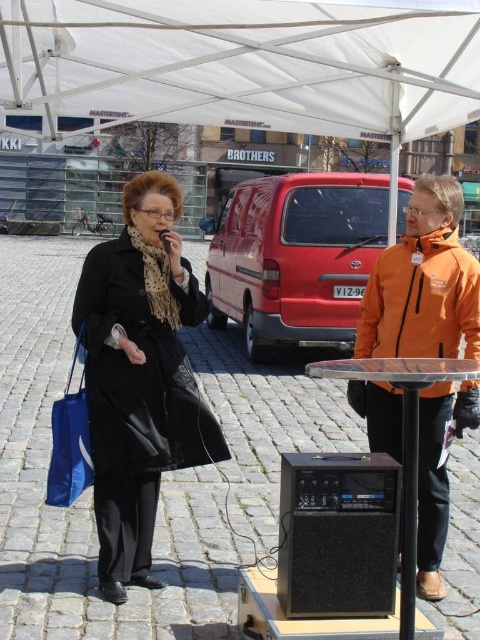
Question: Which object is farther from the camera taking this photo?

Choices:
 (A) black leather coat at center
 (B) white fabric canopy at upper center

Answer: (A)

Question: Among these objects, which one is farthest from the camera?

Choices:
 (A) black leather coat at center
 (B) black matte speaker at lower center
 (C) white fabric canopy at upper center
 (D) matte black microphone at center

Answer: (D)

Question: Which object is positioned closest to the black leather coat at center?

Choices:
 (A) black matte speaker at lower center
 (B) white fabric canopy at upper center

Answer: (A)

Question: From the image, what is the correct spatial relationship of white fabric canopy at upper center in relation to black leather coat at center?

Choices:
 (A) right
 (B) left

Answer: (A)

Question: Observing the image, what is the correct spatial positioning of white fabric canopy at upper center in reference to black matte speaker at lower center?

Choices:
 (A) below
 (B) above

Answer: (B)

Question: Does white fabric canopy at upper center appear over matte black microphone at center?

Choices:
 (A) yes
 (B) no

Answer: (A)